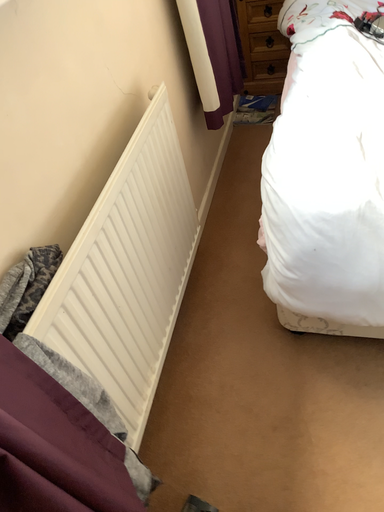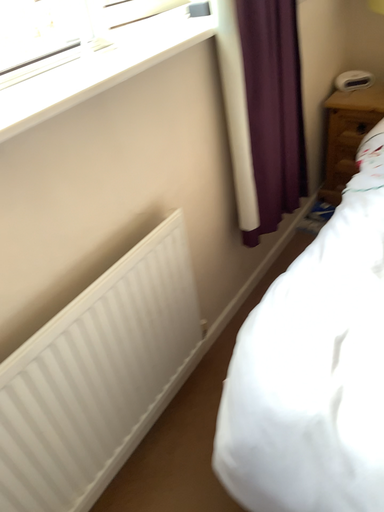
Question: Which way did the camera rotate in the video?

Choices:
 (A) rotated right
 (B) rotated left

Answer: (B)